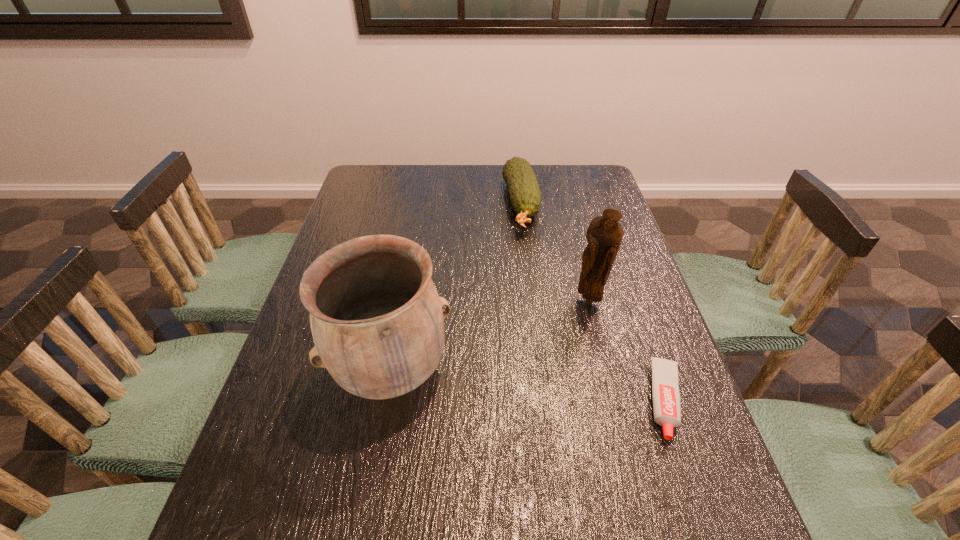
Image resolution: width=960 pixels, height=540 pixels. Identify the location of urn. (376, 318).

Where is `toothpaste`? toothpaste is located at coordinates (665, 392).

Locate an element on the screen. the rightmost object is located at coordinates (665, 392).

Locate an element on the screen. the second shortest object is located at coordinates (525, 195).

What are the coordinates of `the second object from left to right` in the screenshot? It's located at (525, 195).

Find the location of a particular element. the second object from right to left is located at coordinates (604, 235).

You are a GUI agent. You are given a task and a screenshot of the screen. Output one action in this format:
    pyautogui.click(x=<x>, y=<y>)
    Task: Click on the second farthest object
    The height and width of the screenshot is (540, 960).
    Given the screenshot: What is the action you would take?
    click(x=604, y=235)

You are a GUI agent. You are given a task and a screenshot of the screen. Output one action in this format:
    pyautogui.click(x=<x>, y=<y>)
    Task: Click on the vacant space located 0.220m on the back of the leftmost object
    The image size is (960, 540).
    Given the screenshot: What is the action you would take?
    pyautogui.click(x=409, y=268)

This screenshot has width=960, height=540. Find the location of `free point located on the left of the toothpaste`. free point located on the left of the toothpaste is located at coordinates (508, 400).

Find the location of a particular element. vacant region located at the blossom end of the cucumber is located at coordinates (530, 256).